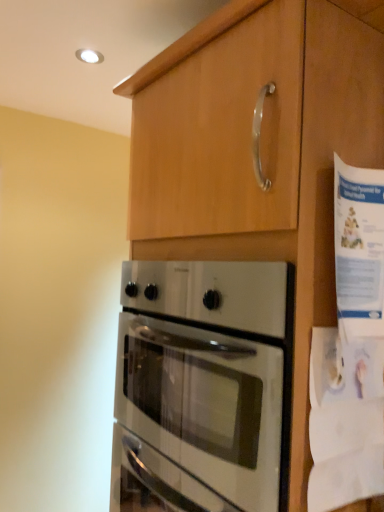
Question: In terms of width, does satin silver oven at center look wider or thinner when compared to matte wood cabinet at upper center?

Choices:
 (A) wide
 (B) thin

Answer: (A)

Question: Is satin silver oven at center inside the boundaries of matte wood cabinet at upper center, or outside?

Choices:
 (A) inside
 (B) outside

Answer: (A)

Question: Which object is positioned closest to the satin silver oven at center?

Choices:
 (A) white paper at right
 (B) matte wood cabinet at upper center

Answer: (B)

Question: Estimate the real-world distances between objects in this image. Which object is farther from the matte wood cabinet at upper center?

Choices:
 (A) satin silver oven at center
 (B) white paper at right

Answer: (A)